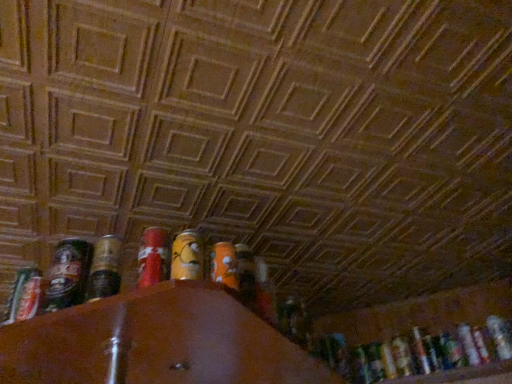
Question: Is metallic silver can at lower right, the fourth beer positioned from the left, next to translucent plastic bottle at lower right, the second beer from the front, and touching it?

Choices:
 (A) yes
 (B) no

Answer: (B)

Question: Is metallic silver can at lower right, which is the 4th beer from front to back, at the left side of translucent plastic bottle at lower right, the first beer viewed from the right?

Choices:
 (A) no
 (B) yes

Answer: (B)

Question: Can you confirm if metallic silver can at lower right, which is the third beer from back to front, is smaller than translucent plastic bottle at lower right, the first beer viewed from the right?

Choices:
 (A) no
 (B) yes

Answer: (B)

Question: From a real-world perspective, does metallic silver can at lower right, which is the 4th beer from front to back, stand above translucent plastic bottle at lower right, placed as the sixth beer when sorted from left to right?

Choices:
 (A) no
 (B) yes

Answer: (B)

Question: From the image's perspective, does metallic silver can at lower right, which is the 4th beer from front to back, appear lower than translucent plastic bottle at lower right, the first beer viewed from the right?

Choices:
 (A) no
 (B) yes

Answer: (B)

Question: Is metallic silver can at lower right, which is the third beer from back to front, positioned far away from translucent plastic bottle at lower right, the first beer viewed from the right?

Choices:
 (A) no
 (B) yes

Answer: (A)

Question: Considering the relative sizes of translucent plastic bottle at lower right, the second beer from the front, and metallic silver spray can at left in the image provided, is translucent plastic bottle at lower right, the second beer from the front, bigger than metallic silver spray can at left?

Choices:
 (A) yes
 (B) no

Answer: (A)

Question: Is translucent plastic bottle at lower right, the first beer viewed from the right, located outside metallic silver spray can at left?

Choices:
 (A) yes
 (B) no

Answer: (A)

Question: Is translucent plastic bottle at lower right, the 5th beer in the back-to-front sequence, positioned before metallic silver spray can at left?

Choices:
 (A) yes
 (B) no

Answer: (B)

Question: Can you confirm if translucent plastic bottle at lower right, the 5th beer in the back-to-front sequence, is thinner than metallic silver spray can at left?

Choices:
 (A) yes
 (B) no

Answer: (B)

Question: Can you confirm if translucent plastic bottle at lower right, the second beer from the front, is positioned to the left of metallic silver spray can at left?

Choices:
 (A) yes
 (B) no

Answer: (B)

Question: Does translucent plastic bottle at lower right, the 5th beer in the back-to-front sequence, have a lesser height compared to metallic silver spray can at left?

Choices:
 (A) no
 (B) yes

Answer: (A)

Question: Can you confirm if shiny metallic can at left, the 6th beer from the right, is bigger than metallic silver can at lower right, the third beer when ordered from front to back?

Choices:
 (A) no
 (B) yes

Answer: (B)